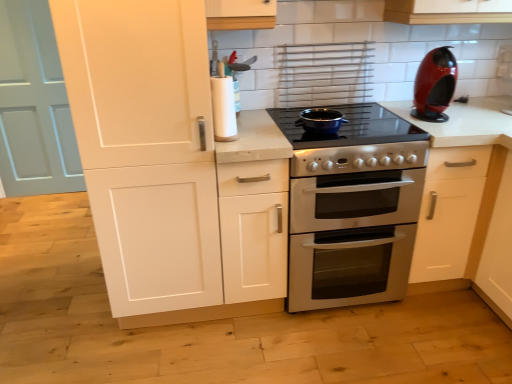
Question: Can you confirm if smooth white countertop at center is bigger than white matte cabinet at left?

Choices:
 (A) yes
 (B) no

Answer: (B)

Question: From the image's perspective, is smooth white countertop at center on top of white matte cabinet at left?

Choices:
 (A) no
 (B) yes

Answer: (A)

Question: Considering the relative positions of smooth white countertop at center and white matte cabinet at left in the image provided, is smooth white countertop at center to the right of white matte cabinet at left from the viewer's perspective?

Choices:
 (A) no
 (B) yes

Answer: (B)

Question: Considering the relative sizes of smooth white countertop at center and white matte cabinet at left in the image provided, is smooth white countertop at center thinner than white matte cabinet at left?

Choices:
 (A) yes
 (B) no

Answer: (B)

Question: Is the depth of smooth white countertop at center greater than that of white matte cabinet at left?

Choices:
 (A) yes
 (B) no

Answer: (A)

Question: Does smooth white countertop at center have a smaller size compared to white matte cabinet at left?

Choices:
 (A) yes
 (B) no

Answer: (A)

Question: Considering the relative positions of matte black pot at center and glossy plastic coffee machine at upper right in the image provided, is matte black pot at center behind glossy plastic coffee machine at upper right?

Choices:
 (A) no
 (B) yes

Answer: (A)

Question: Is matte black pot at center positioned in front of glossy plastic coffee machine at upper right?

Choices:
 (A) yes
 (B) no

Answer: (A)

Question: Considering the relative sizes of matte black pot at center and glossy plastic coffee machine at upper right in the image provided, is matte black pot at center thinner than glossy plastic coffee machine at upper right?

Choices:
 (A) no
 (B) yes

Answer: (B)

Question: Does matte black pot at center have a greater height compared to glossy plastic coffee machine at upper right?

Choices:
 (A) yes
 (B) no

Answer: (B)

Question: From the image's perspective, does matte black pot at center appear higher than glossy plastic coffee machine at upper right?

Choices:
 (A) no
 (B) yes

Answer: (A)

Question: Can you confirm if matte black pot at center is positioned to the left of glossy plastic coffee machine at upper right?

Choices:
 (A) no
 (B) yes

Answer: (B)

Question: Considering the relative sizes of light blue wood door at left and matte black pot at center in the image provided, is light blue wood door at left shorter than matte black pot at center?

Choices:
 (A) yes
 (B) no

Answer: (B)